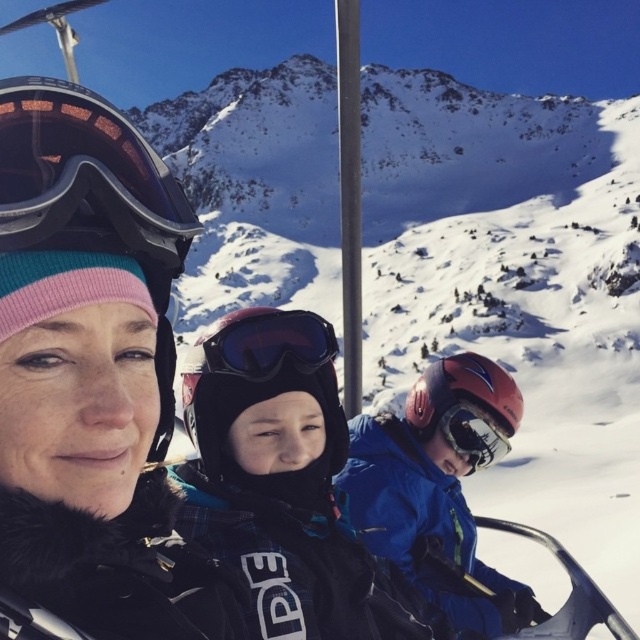
You are standing at the base of the mountain and want to reach the black matte ski jacket at center and the matte black goggles at upper left. Which object is closer to you?

The black matte ski jacket at center is closer to you since it is only 5.93 meters away from the matte black goggles at upper left, but without knowing your exact position, we can only compare their distance to each other. However, since the goggles are at upper left and the jacket is at center, the jacket might be closer if you are at the base.

What is the exact coordinate of the matte black helmet at center?

The matte black helmet at center is located at point (147, 355).